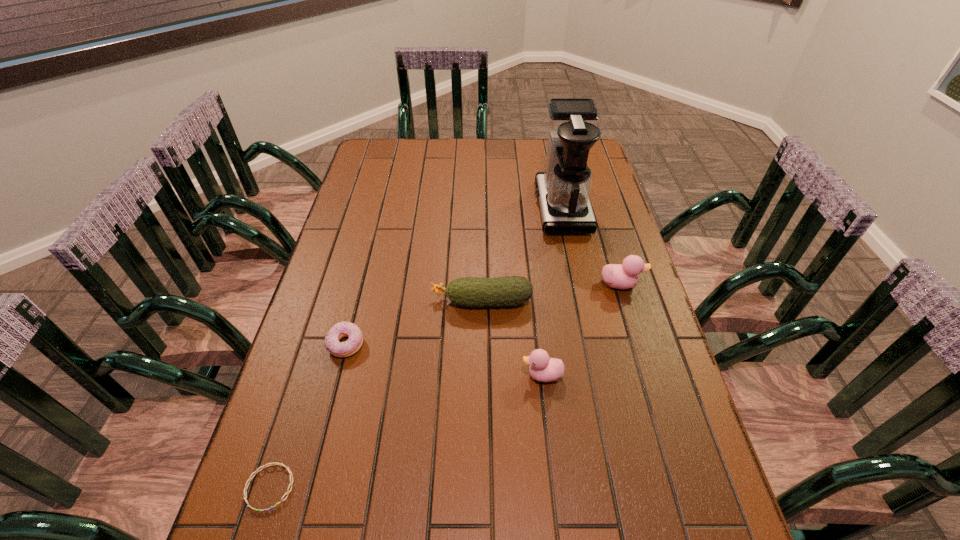
Locate an element on the screen. This screenshot has width=960, height=540. the left duckling is located at coordinates (542, 368).

Find the location of a particular element. The width and height of the screenshot is (960, 540). the fifth farthest object is located at coordinates (542, 368).

Locate an element on the screen. The width and height of the screenshot is (960, 540). the taller duckling is located at coordinates [625, 276].

Locate an element on the screen. Image resolution: width=960 pixels, height=540 pixels. the second tallest object is located at coordinates (625, 276).

Where is `the tallest object`? the tallest object is located at coordinates (563, 190).

Where is `coffee maker`? This screenshot has width=960, height=540. coffee maker is located at coordinates (563, 190).

Identify the location of the fourth farthest object. (342, 329).

Locate an element on the screen. The image size is (960, 540). the fifth tallest object is located at coordinates (342, 329).

At what (x,y) coordinates should I click in order to perform the action: click on cucumber. Please return your answer as a coordinate pair (x, y). Image resolution: width=960 pixels, height=540 pixels. Looking at the image, I should click on (507, 291).

Image resolution: width=960 pixels, height=540 pixels. In order to click on the shortest object in this screenshot , I will do `click(274, 463)`.